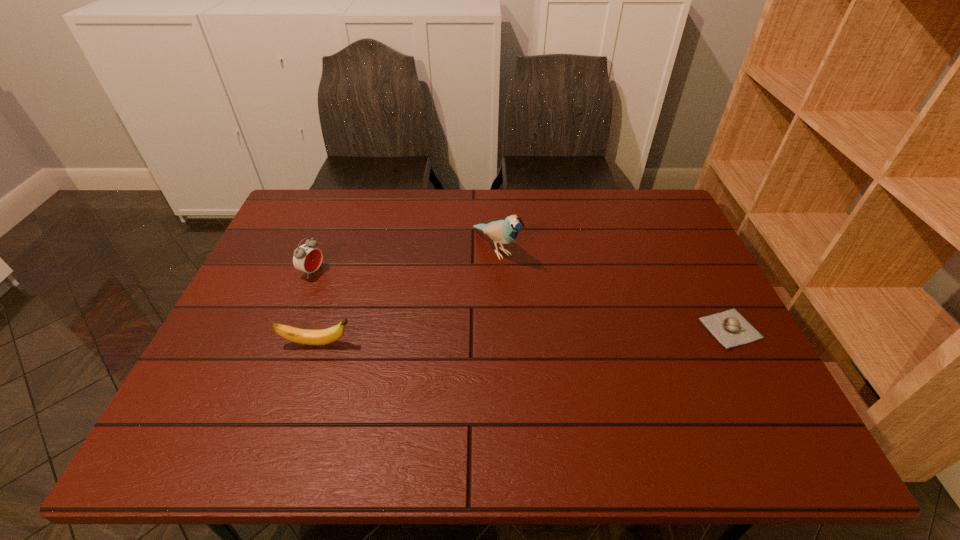
Identify the location of free space located 0.320m on the face of the alarm clock. The image size is (960, 540). (418, 317).

Where is `free space located at the face of the tallest object`? This screenshot has width=960, height=540. free space located at the face of the tallest object is located at coordinates (532, 288).

This screenshot has height=540, width=960. I want to click on vacant point located at the face of the tallest object, so click(x=556, y=311).

I want to click on vacant space positioned 0.390m at the face of the tallest object, so click(611, 362).

Locate an element on the screen. object positioned at the far edge is located at coordinates (505, 231).

Locate an element on the screen. The width and height of the screenshot is (960, 540). banana that is at the left edge is located at coordinates (302, 336).

The width and height of the screenshot is (960, 540). What are the coordinates of `alarm clock located at the left edge` in the screenshot? It's located at (307, 258).

Where is `object that is at the right edge`? This screenshot has width=960, height=540. object that is at the right edge is located at coordinates (729, 327).

Find the location of a particular element. The height and width of the screenshot is (540, 960). vacant space at the far edge is located at coordinates (348, 200).

Find the location of a particular element. free space at the near edge of the desktop is located at coordinates (376, 374).